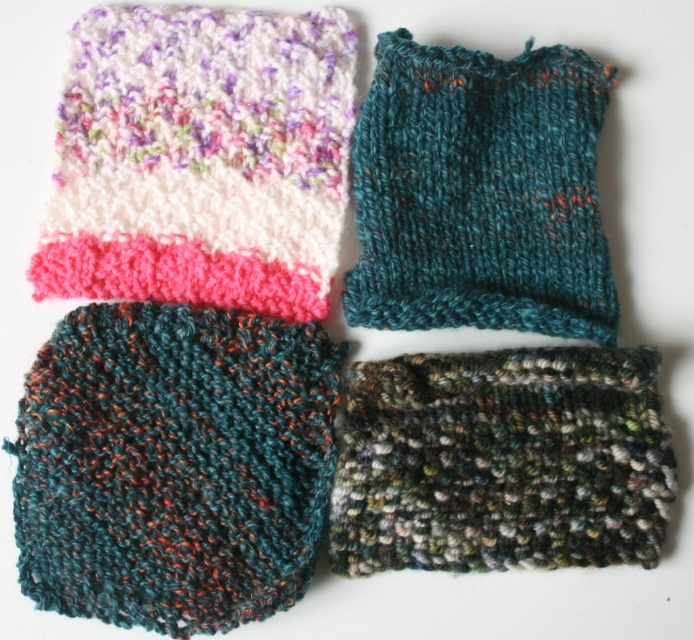
Question: Which object is farther from the camera taking this photo?

Choices:
 (A) multicolored knitted sock at upper left
 (B) multicolored knitted sock at bottom left
 (C) teal knitted sock at upper right
 (D) multicolored yarn sock at bottom right

Answer: (C)

Question: Is multicolored knitted sock at bottom left above teal knitted sock at upper right?

Choices:
 (A) no
 (B) yes

Answer: (A)

Question: In this image, where is multicolored knitted sock at bottom left located relative to multicolored yarn sock at bottom right?

Choices:
 (A) above
 (B) below

Answer: (B)

Question: Considering the relative positions of multicolored knitted sock at bottom left and multicolored yarn sock at bottom right in the image provided, where is multicolored knitted sock at bottom left located with respect to multicolored yarn sock at bottom right?

Choices:
 (A) right
 (B) left

Answer: (B)

Question: Which object appears farthest from the camera in this image?

Choices:
 (A) multicolored knitted sock at bottom left
 (B) multicolored knitted sock at upper left
 (C) multicolored yarn sock at bottom right

Answer: (B)

Question: Which object appears closest to the camera in this image?

Choices:
 (A) multicolored yarn sock at bottom right
 (B) multicolored knitted sock at bottom left

Answer: (B)